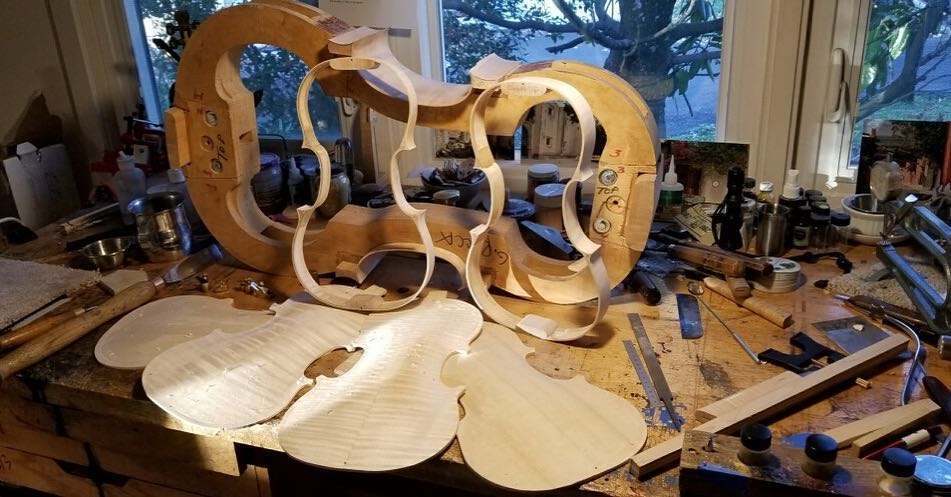
This screenshot has height=497, width=951. In order to click on window frame in this screenshot , I will do `click(98, 44)`, `click(378, 14)`, `click(749, 55)`, `click(846, 18)`.